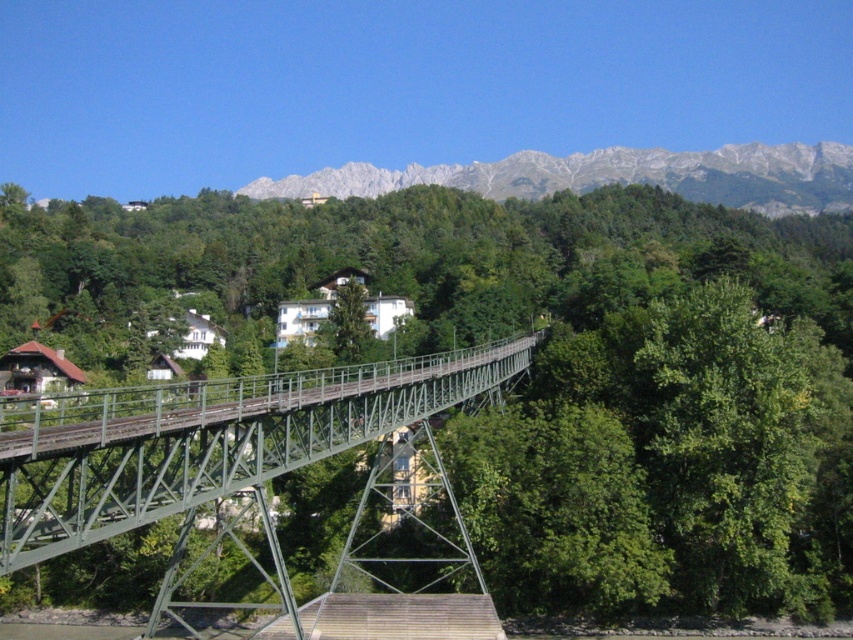
You are an architect designing a new park and want to place a small garden between the green leafy tree at center and the gray rocky mountain at upper center. Which object should the garden be closer to if it needs to be narrower than both?

The garden should be closer to the green leafy tree at center because it is thinner than the gray rocky mountain at upper center, allowing the garden to fit within the narrower space.

You are an engineer assessing the structural integrity of the green metallic bridge at center and the gray rocky mountain at upper center. Which structure has a narrower width?

The green metallic bridge at center is thinner than the gray rocky mountain at upper center, so the green metallic bridge at center has a narrower width.

Looking at this image, you are a landscape architect evaluating the image. You need to determine if the green leafy tree at center can be safely removed without affecting the structural integrity of the green metallic bridge at center. Based on their widths, can the tree be removed?

The green leafy tree at center has a larger width than the green metallic bridge at center. Since the tree is wider, removing it might impact the bridge if the tree roots are near the bridge structure. Therefore, consult an engineer before removal.